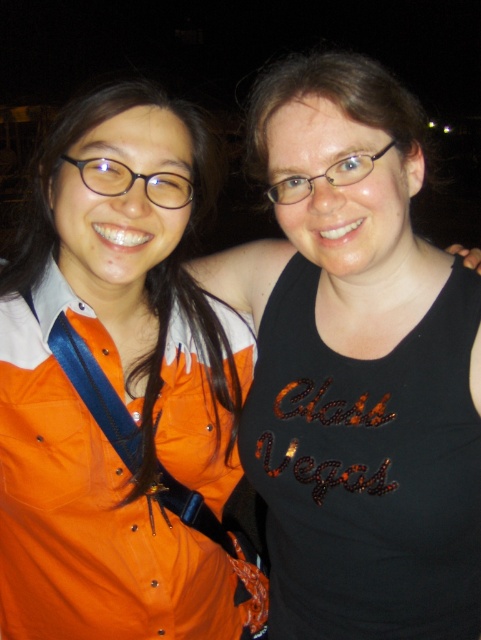
Based on the photo, between black sequined tank top at center and orange fabric shirt at left, which one has less height?

With less height is orange fabric shirt at left.

In the scene shown: Is black sequined tank top at center bigger than orange fabric shirt at left?

Indeed, black sequined tank top at center has a larger size compared to orange fabric shirt at left.

Between point (320, 636) and point (223, 333), which one is positioned behind?

The point (223, 333) is more distant.

Where is `black sequined tank top at center`? Image resolution: width=481 pixels, height=640 pixels. black sequined tank top at center is located at coordinates (367, 470).

Is black sequined tank top at center below orange fabric apron at left?

Incorrect, black sequined tank top at center is not positioned below orange fabric apron at left.

Is black sequined tank top at center wider than orange fabric apron at left?

Incorrect, black sequined tank top at center's width does not surpass orange fabric apron at left's.

Does point (399, 541) come farther from viewer compared to point (241, 589)?

No, (399, 541) is closer to viewer.

The image size is (481, 640). I want to click on black sequined tank top at center, so click(x=367, y=470).

Is point (173, 413) positioned before point (86, 113)?

No, (173, 413) is behind (86, 113).

Is orange fabric apron at left smaller than orange fabric shirt at left?

Actually, orange fabric apron at left might be larger than orange fabric shirt at left.

Does point (205, 481) come in front of point (40, 246)?

That is False.

Identify the location of orange fabric apron at left. This screenshot has height=640, width=481. (91, 502).